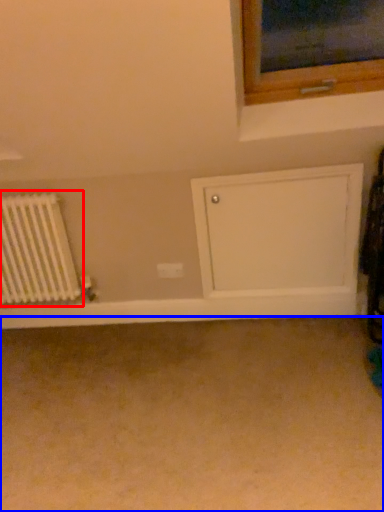
Question: Which object is closer to the camera taking this photo, radiator (highlighted by a red box) or plain (highlighted by a blue box)?

Choices:
 (A) radiator
 (B) plain

Answer: (B)